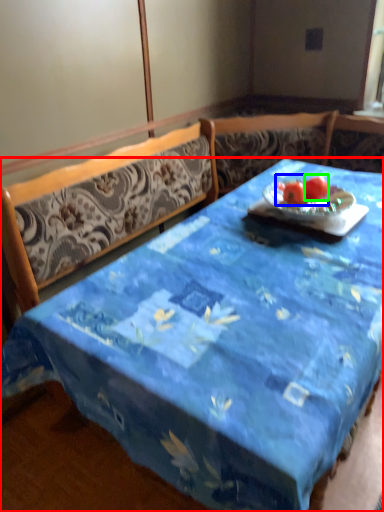
Question: Considering the real-world distances, which object is farthest from desk (highlighted by a red box)? fruit (highlighted by a blue box) or tomato (highlighted by a green box)?

Choices:
 (A) fruit
 (B) tomato

Answer: (B)